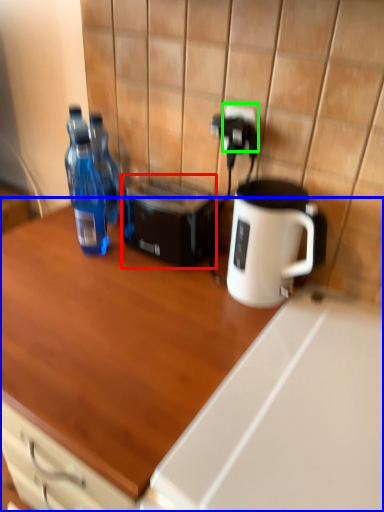
Question: Which is nearer to the toaster (highlighted by a red box)? desk (highlighted by a blue box) or electric outlet (highlighted by a green box).

Choices:
 (A) desk
 (B) electric outlet

Answer: (B)